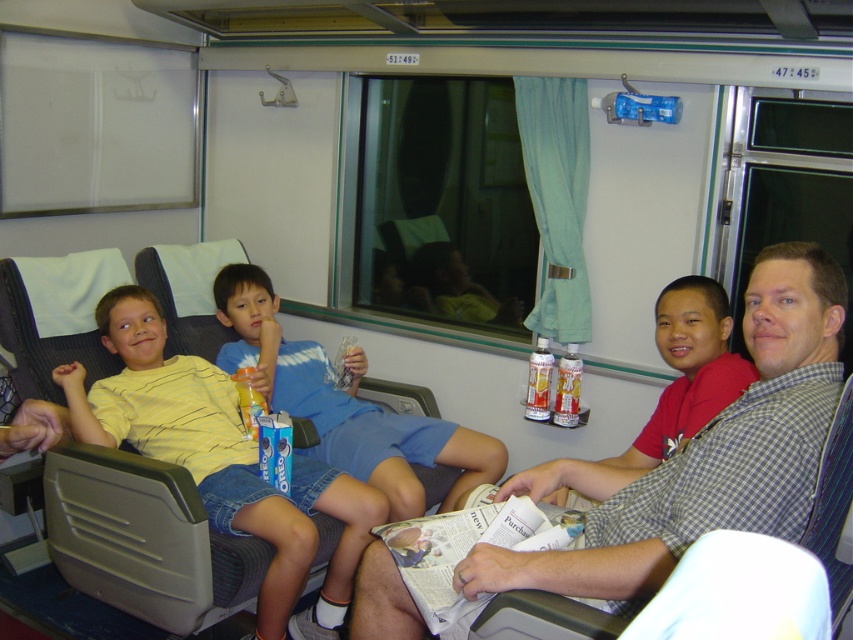
Question: Is checkered fabric shirt at center bigger than blue denim shorts at center?

Choices:
 (A) no
 (B) yes

Answer: (A)

Question: Can you confirm if checkered fabric shirt at center is positioned to the left of red cotton shirt at right?

Choices:
 (A) no
 (B) yes

Answer: (B)

Question: Which point is farther to the camera?

Choices:
 (A) (776, 490)
 (B) (144, 445)
 (C) (698, 308)
 (D) (346, 452)

Answer: (D)

Question: Which of the following is the farthest from the observer?

Choices:
 (A) blue denim shorts at center
 (B) red cotton shirt at right

Answer: (A)

Question: Which of the following is the farthest from the observer?

Choices:
 (A) yellow striped shirt at left
 (B) blue denim shorts at center
 (C) red cotton shirt at right

Answer: (B)

Question: Is blue denim shorts at center above red cotton shirt at right?

Choices:
 (A) no
 (B) yes

Answer: (A)